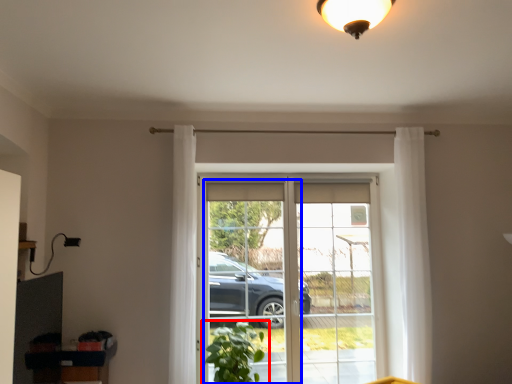
Question: Which object is further to the camera taking this photo, houseplant (highlighted by a red box) or screen door (highlighted by a blue box)?

Choices:
 (A) houseplant
 (B) screen door

Answer: (B)